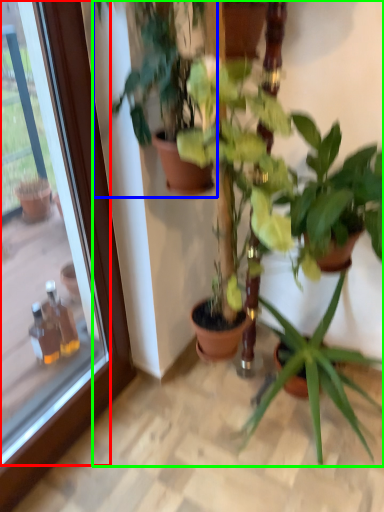
Question: Which object is the farthest from glass door (highlighted by a red box)? Choose among these: houseplant (highlighted by a blue box) or houseplant (highlighted by a green box).

Choices:
 (A) houseplant
 (B) houseplant

Answer: (B)